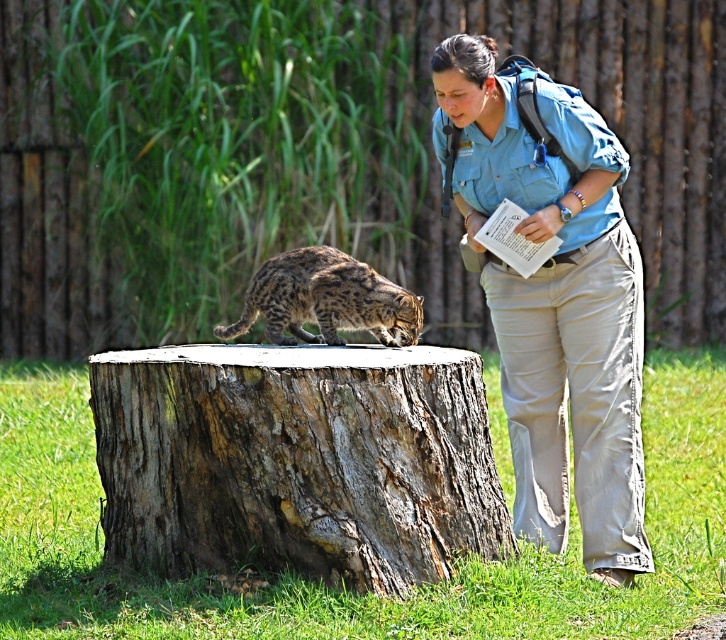
Question: Can you confirm if rough bark tree stump at center is positioned to the left of spotted fur cat at center?

Choices:
 (A) yes
 (B) no

Answer: (A)

Question: Which of the following is the closest to the observer?

Choices:
 (A) spotted fur cat at center
 (B) rough bark tree stump at center

Answer: (B)

Question: Is rough bark tree stump at center bigger than blue uniform at center?

Choices:
 (A) no
 (B) yes

Answer: (B)

Question: Which point appears closest to the camera in this image?

Choices:
 (A) (333, 317)
 (B) (619, 381)
 (C) (383, 490)

Answer: (C)

Question: Among these points, which one is nearest to the camera?

Choices:
 (A) (297, 336)
 (B) (285, 392)
 (C) (615, 164)

Answer: (B)

Question: Can you confirm if rough bark tree stump at center is positioned below blue uniform at center?

Choices:
 (A) no
 (B) yes

Answer: (B)